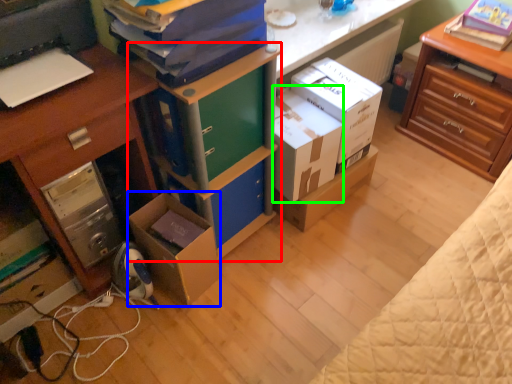
Question: Which object is positioned farthest from bookshelf (highlighted by a red box)? Select from box (highlighted by a blue box) and box (highlighted by a green box).

Choices:
 (A) box
 (B) box

Answer: (A)